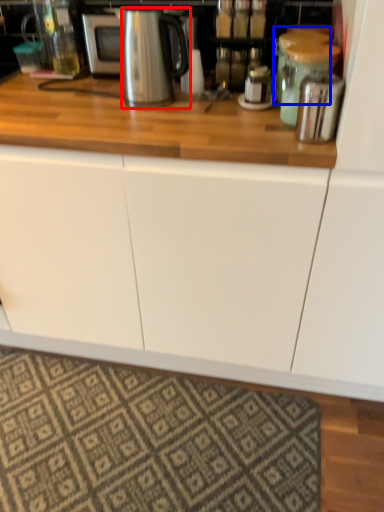
Question: Which of the following is the closest to the observer, kitchen appliance (highlighted by a red box) or appliance (highlighted by a blue box)?

Choices:
 (A) kitchen appliance
 (B) appliance

Answer: (A)